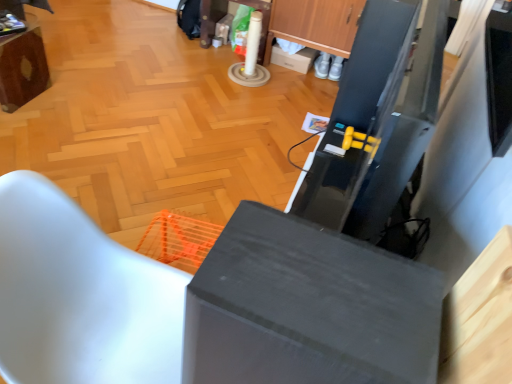
The height and width of the screenshot is (384, 512). What are the coordinates of `vacant space situated above matte gray cabinet at center (from a real-world perspective)` in the screenshot? It's located at (327, 280).